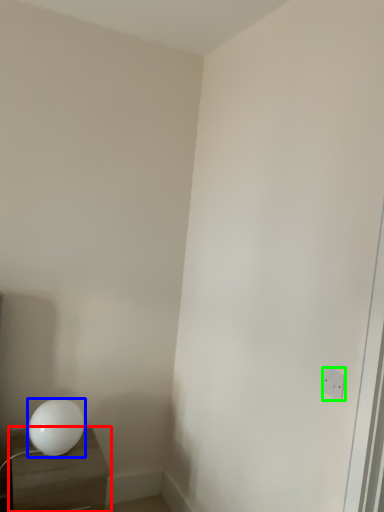
Question: Estimate the real-world distances between objects in this image. Which object is closer to nightstand (highlighted by a red box), lamp (highlighted by a blue box) or electric outlet (highlighted by a green box)?

Choices:
 (A) lamp
 (B) electric outlet

Answer: (A)